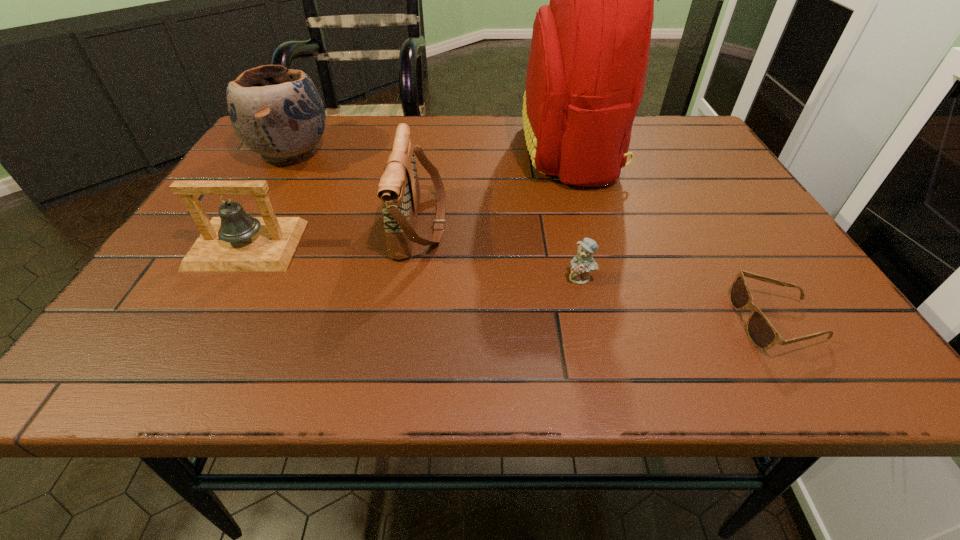
The height and width of the screenshot is (540, 960). Find the location of `pottery located in the left edge section of the desktop`. pottery located in the left edge section of the desktop is located at coordinates (276, 112).

You are a GUI agent. You are given a task and a screenshot of the screen. Output one action in this format:
    pyautogui.click(x=<x>, y=<y>)
    Task: Click on the bell situated at the left edge
    
    Given the screenshot: What is the action you would take?
    pyautogui.click(x=235, y=241)

You are a GUI agent. You are given a task and a screenshot of the screen. Output one action in this format:
    pyautogui.click(x=<x>, y=<y>)
    Task: Click on the object that is at the right edge
    
    Given the screenshot: What is the action you would take?
    pyautogui.click(x=763, y=335)

Identify the location of object present at the far left corner. The image size is (960, 540). (276, 112).

Find the location of `object that is at the near right corner`. object that is at the near right corner is located at coordinates pos(763,335).

At what (x,y) coordinates should I click in order to perform the action: click on free space at the far edge of the desktop. Please return your answer as a coordinate pair (x, y). This screenshot has height=540, width=960. Looking at the image, I should click on (481, 146).

This screenshot has width=960, height=540. In order to click on free space at the near edge of the desktop in this screenshot , I will do `click(275, 357)`.

Image resolution: width=960 pixels, height=540 pixels. In order to click on free space at the left edge in this screenshot , I will do `click(178, 260)`.

The image size is (960, 540). Find the location of `vacant space at the right edge of the desktop`. vacant space at the right edge of the desktop is located at coordinates (738, 266).

In the image, there is a desktop. At what (x,y) coordinates should I click in order to perform the action: click on vacant area at the far right corner. Please return your answer as a coordinate pair (x, y). Looking at the image, I should click on (689, 124).